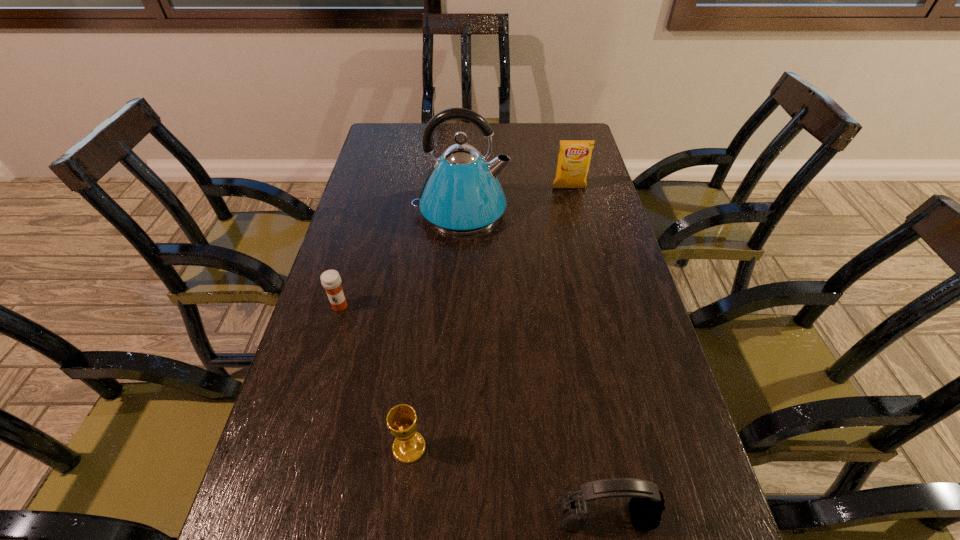
I want to click on object present at the left edge, so click(x=331, y=281).

I want to click on crisp (potato chip) that is at the right edge, so click(x=574, y=157).

At what (x,y) coordinates should I click in order to perform the action: click on headset located at the right edge. Please return your answer as a coordinate pair (x, y). Image resolution: width=960 pixels, height=540 pixels. Looking at the image, I should click on (646, 506).

Find the location of `vacant space at the far edge`. vacant space at the far edge is located at coordinates (449, 127).

Locate an element on the screen. This screenshot has width=960, height=540. blank space at the left edge of the desktop is located at coordinates (x=324, y=297).

This screenshot has height=540, width=960. Find the location of `vacant space at the right edge`. vacant space at the right edge is located at coordinates (644, 431).

Locate an element on the screen. free space at the far left corner of the desktop is located at coordinates (376, 127).

Where is `vacant area at the far right corner of the desktop`? vacant area at the far right corner of the desktop is located at coordinates (558, 155).

This screenshot has height=540, width=960. What are the coordinates of `free space between the leftmost object and the headset` in the screenshot? It's located at (472, 412).

The width and height of the screenshot is (960, 540). I want to click on unoccupied area between the headset and the crisp (potato chip), so click(x=588, y=353).